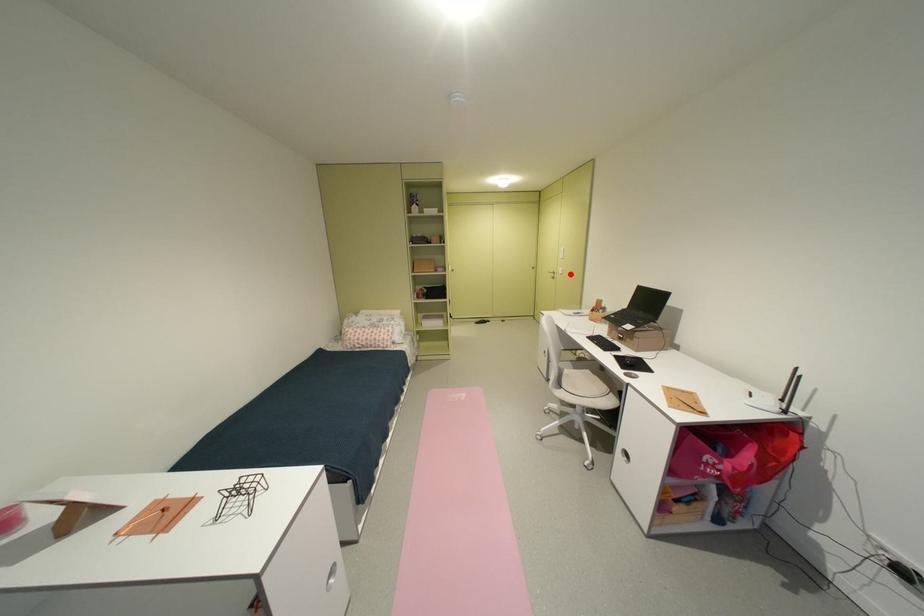
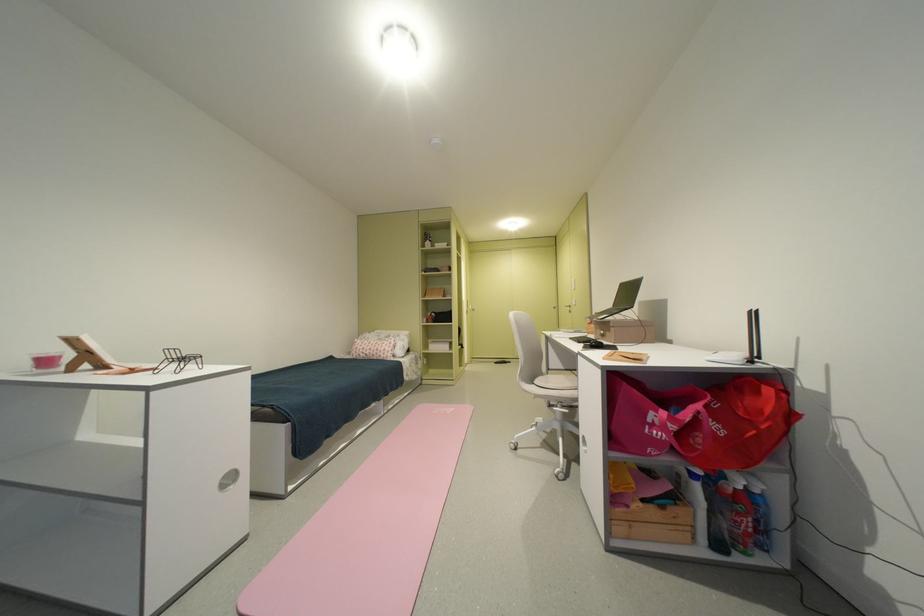
Question: I am providing you with two images of the same scene from different viewpoints. Given a red point in image1, look at the same physical point in image2. Is it:

Choices:
 (A) Closer to the viewpoint
 (B) Farther from the viewpoint

Answer: (B)